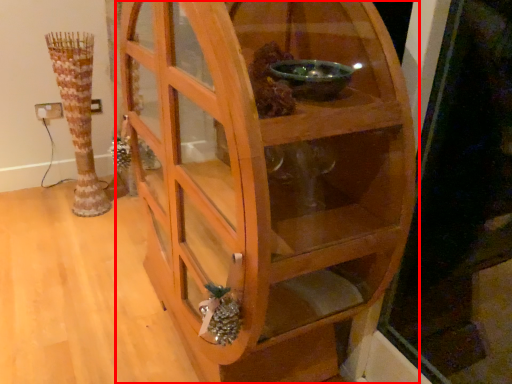
Question: Considering the relative positions of shelf (annotated by the red box) and vase in the image provided, where is shelf (annotated by the red box) located with respect to the staircase?

Choices:
 (A) left
 (B) right

Answer: (B)